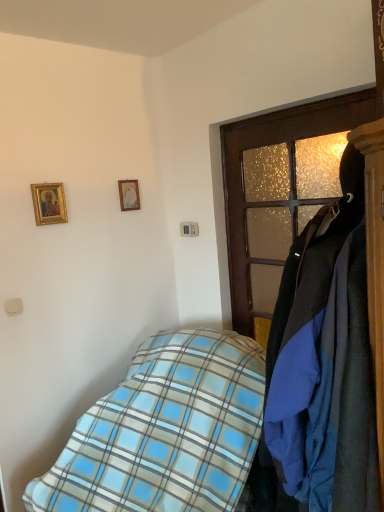
Question: Is the position of blue plaid blanket at lower left, which is counted as the first bed, starting from the back, less distant than that of gold-framed painting at upper left, which is the 1th picture frame in front-to-back order?

Choices:
 (A) no
 (B) yes

Answer: (B)

Question: Considering the relative sizes of blue plaid blanket at lower left, arranged as the second bed when viewed from the front, and gold-framed painting at upper left, which is counted as the 2th picture frame, starting from the right, in the image provided, is blue plaid blanket at lower left, arranged as the second bed when viewed from the front, shorter than gold-framed painting at upper left, which is counted as the 2th picture frame, starting from the right,?

Choices:
 (A) yes
 (B) no

Answer: (B)

Question: From a real-world perspective, does blue plaid blanket at lower left, arranged as the second bed when viewed from the front, sit lower than gold-framed painting at upper left, acting as the second picture frame starting from the back?

Choices:
 (A) no
 (B) yes

Answer: (B)

Question: From a real-world perspective, is blue plaid blanket at lower left, which is counted as the first bed, starting from the back, positioned over gold-framed painting at upper left, the 1th picture frame from the left, based on gravity?

Choices:
 (A) no
 (B) yes

Answer: (A)

Question: Can you confirm if blue plaid blanket at lower left, arranged as the second bed when viewed from the front, is positioned to the right of gold-framed painting at upper left, which is the 1th picture frame in front-to-back order?

Choices:
 (A) no
 (B) yes

Answer: (B)

Question: Considering the relative sizes of blue plaid blanket at lower left, which is counted as the first bed, starting from the back, and gold-framed painting at upper left, which is the 1th picture frame in front-to-back order, in the image provided, is blue plaid blanket at lower left, which is counted as the first bed, starting from the back, taller than gold-framed painting at upper left, which is the 1th picture frame in front-to-back order,?

Choices:
 (A) no
 (B) yes

Answer: (B)

Question: Is blue plaid blanket at lower left, the second bed viewed from the back, at the back of wooden picture frame at upper center, the second picture frame when ordered from front to back?

Choices:
 (A) no
 (B) yes

Answer: (A)

Question: Is wooden picture frame at upper center, which is the first picture frame in back-to-front order, next to blue plaid blanket at lower left, the 1th bed viewed from the front, and touching it?

Choices:
 (A) yes
 (B) no

Answer: (B)

Question: Is wooden picture frame at upper center, the 1th picture frame from the right, at the right side of blue plaid blanket at lower left, the second bed viewed from the back?

Choices:
 (A) yes
 (B) no

Answer: (B)

Question: From the image's perspective, is wooden picture frame at upper center, which is the first picture frame in back-to-front order, located above blue plaid blanket at lower left, the 1th bed viewed from the front?

Choices:
 (A) yes
 (B) no

Answer: (A)

Question: Is blue plaid blanket at lower left, the 1th bed viewed from the front, located within wooden picture frame at upper center, the second picture frame in the left-to-right sequence?

Choices:
 (A) no
 (B) yes

Answer: (A)

Question: Is wooden picture frame at upper center, the 1th picture frame from the right, facing towards blue plaid blanket at lower left, the second bed viewed from the back?

Choices:
 (A) no
 (B) yes

Answer: (B)

Question: Does gold-framed painting at upper left, the 1th picture frame from the left, come behind wooden door at right?

Choices:
 (A) no
 (B) yes

Answer: (B)